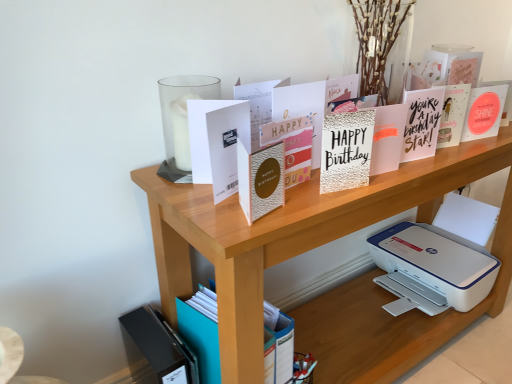
Image resolution: width=512 pixels, height=384 pixels. Find the location of `free spot in front of white matte card at upper center, which is counted as the 1th paperback book, starting from the left`. free spot in front of white matte card at upper center, which is counted as the 1th paperback book, starting from the left is located at coordinates (224, 221).